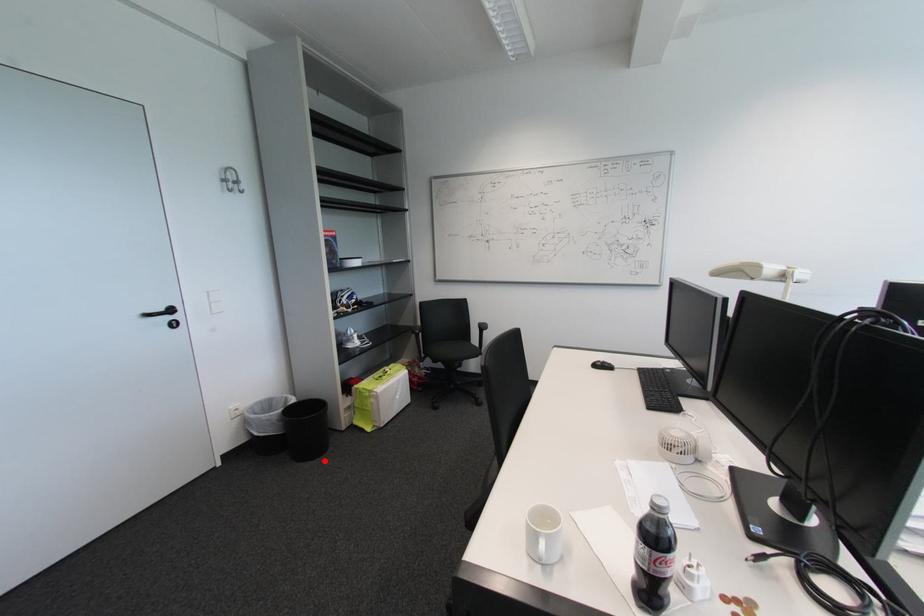
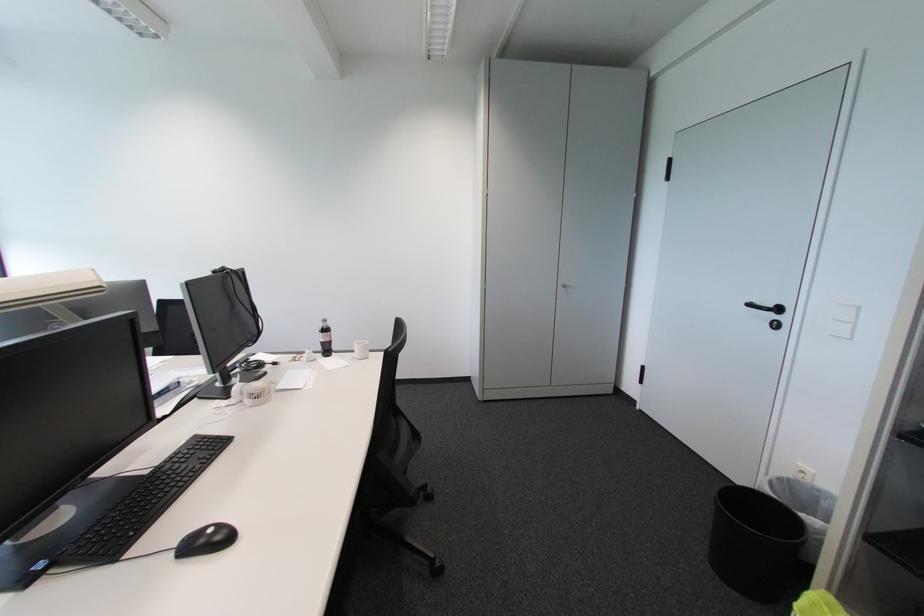
Locate, in the second image, the point that corresponds to the highlighted location in the first image.

(714, 565)